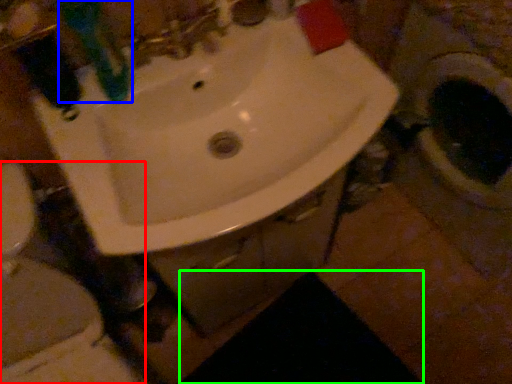
Question: Which object is positioned closest to toilet (highlighted by a red box)? Select from toothbrush (highlighted by a blue box) and dark (highlighted by a green box).

Choices:
 (A) toothbrush
 (B) dark

Answer: (A)